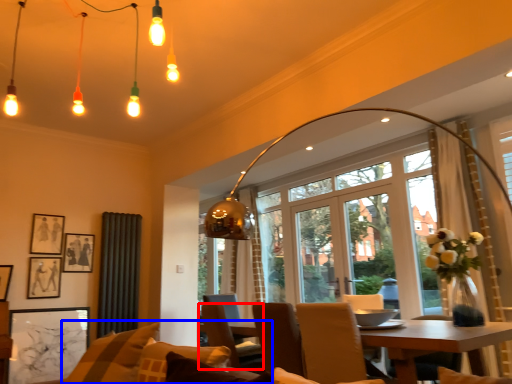
Question: Which object is closer to the camera taking this photo, chair (highlighted by a red box) or couch (highlighted by a blue box)?

Choices:
 (A) chair
 (B) couch

Answer: (B)